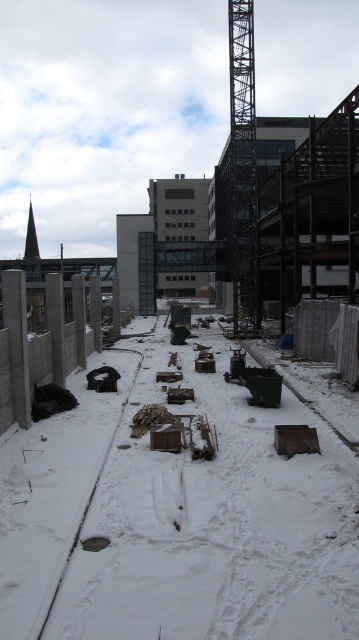
You are a delivery driver who needs to park your truck, which is 2.5 meters wide, between the rusty metal debris at center and the black rubber train track at lower left. Can you fit your truck between them without touching either object?

The rusty metal debris at center and the black rubber train track at lower left are 2.00 meters apart. Since your truck is 2.5 meters wide, it cannot fit between them as the distance is narrower than the truck.

You are a delivery driver who needs to park your truck near the black metal crane at center without blocking the black rubber train track at lower left. Given that your truck is 3 meters wide, can you safely park there?

The black metal crane at center is larger in size than the black rubber train track at lower left, but the description does not provide specific measurements about the distance between them or the available space. Therefore, it is unclear if the truck can safely park without blocking the train track.